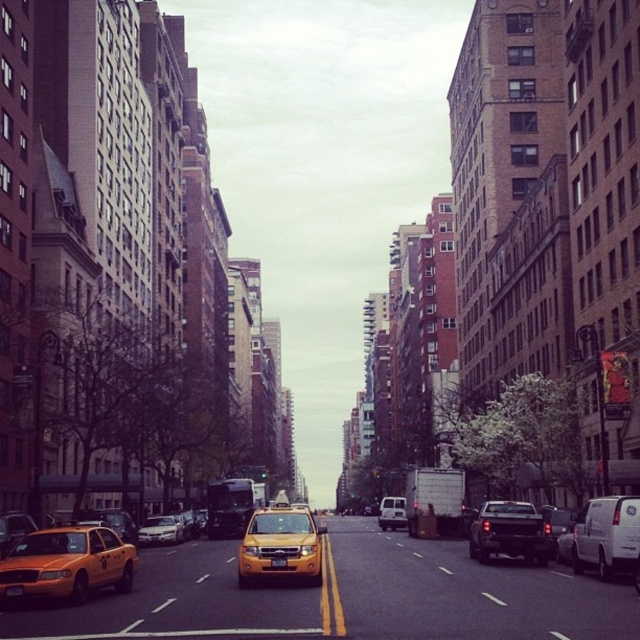
Question: Can you confirm if silver metallic sedan at center is thinner than yellow matte taxi cab at left?

Choices:
 (A) yes
 (B) no

Answer: (B)

Question: Which point is closer to the camera taking this photo?

Choices:
 (A) (141, 538)
 (B) (284, 561)

Answer: (B)

Question: Which object appears closest to the camera in this image?

Choices:
 (A) yellow plastic taxi at lower left
 (B) yellow plastic license plate at center
 (C) yellow matte taxi cab at left

Answer: (A)

Question: Is yellow matte taxi at center bigger than yellow plastic license plate at center?

Choices:
 (A) no
 (B) yes

Answer: (B)

Question: Can you confirm if black matte truck at center is wider than white matte van at center?

Choices:
 (A) yes
 (B) no

Answer: (A)

Question: Estimate the real-world distances between objects in this image. Which object is closer to the yellow matte taxi cab at left?

Choices:
 (A) white matte van at center
 (B) yellow plastic license plate at center
 (C) yellow matte taxi at center

Answer: (C)